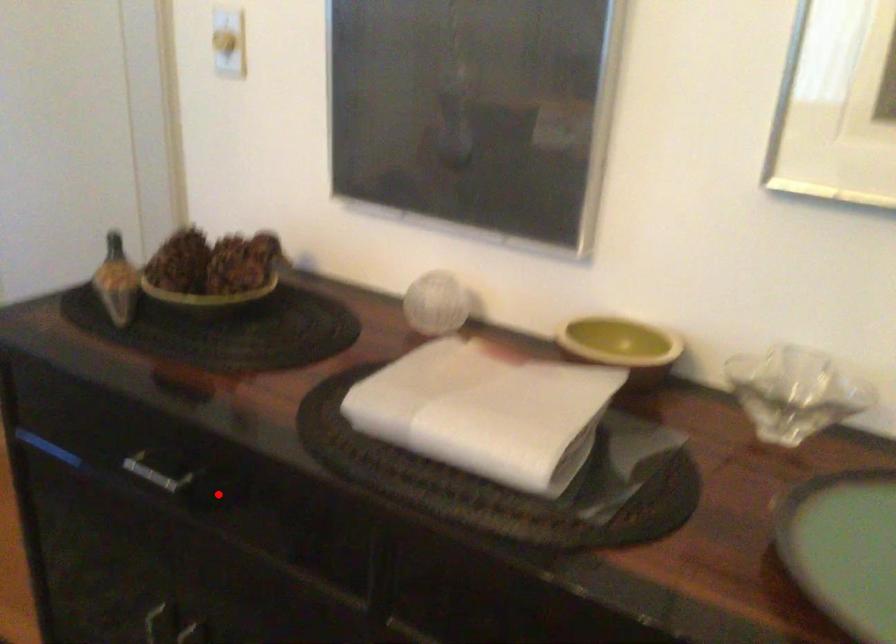
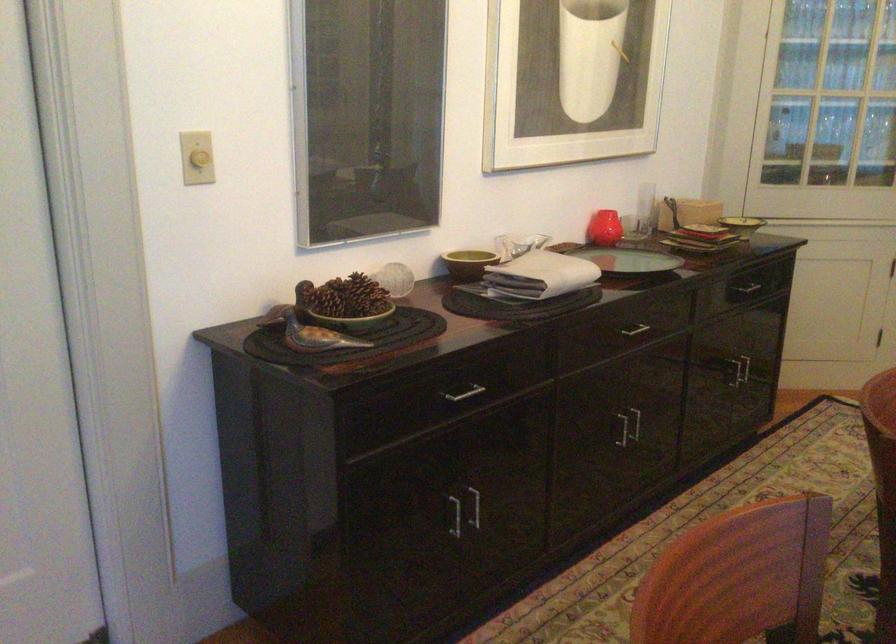
Question: I am providing you with two images of the same scene from different viewpoints. A red point is shown in image1. For the corresponding object point in image2, is it positioned nearer or farther from the camera?

Choices:
 (A) Nearer
 (B) Farther

Answer: (B)